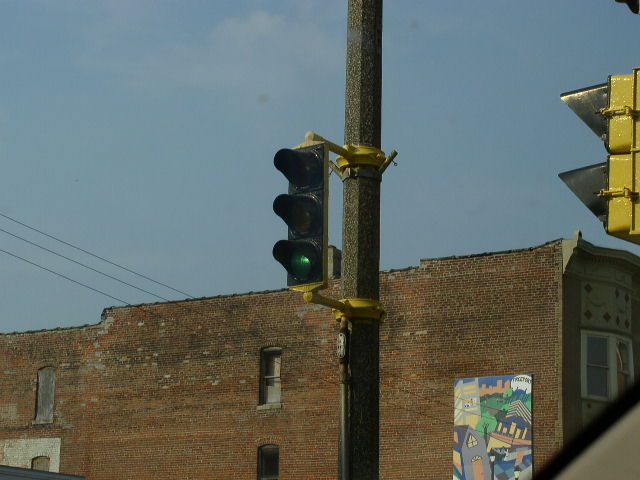
Locate an element on the screen. The height and width of the screenshot is (480, 640). boarded up window is located at coordinates (48, 396), (43, 464), (275, 366).